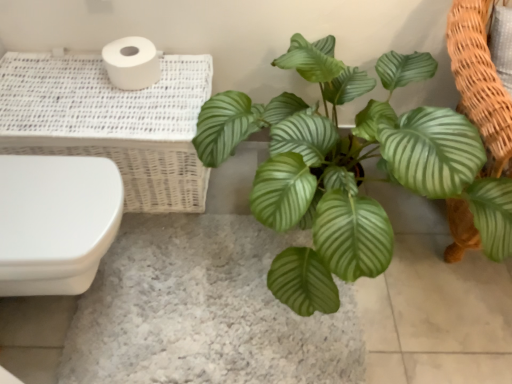
Find the location of `free spot in front of white matte toilet paper at upper left`. free spot in front of white matte toilet paper at upper left is located at coordinates (121, 108).